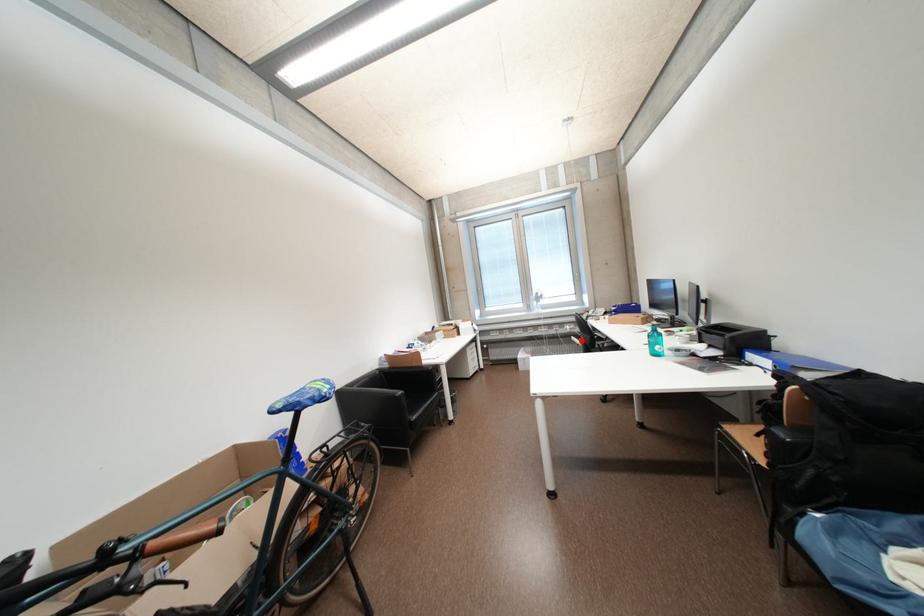
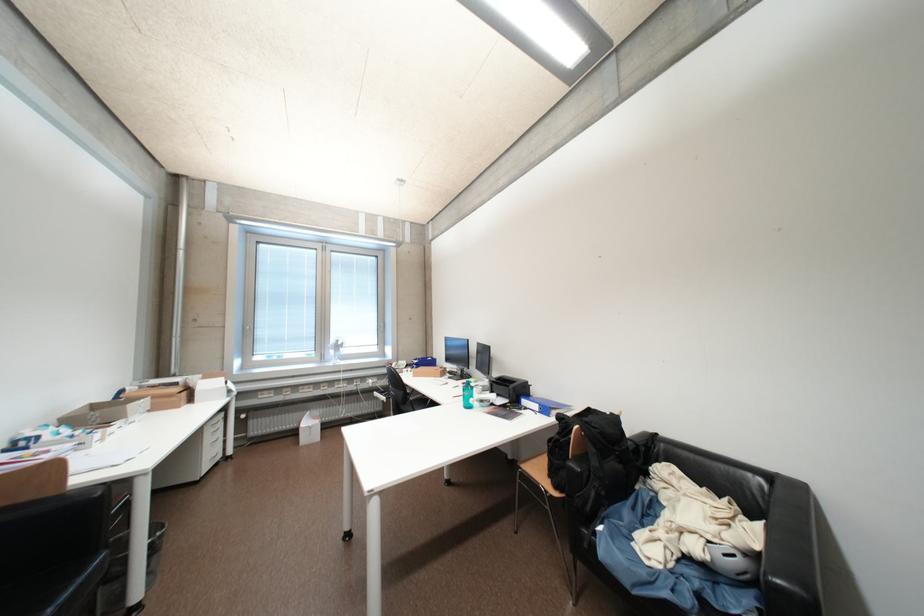
The point at the highlighted location is marked in the first image. Where is the corresponding point in the second image?

(383, 395)